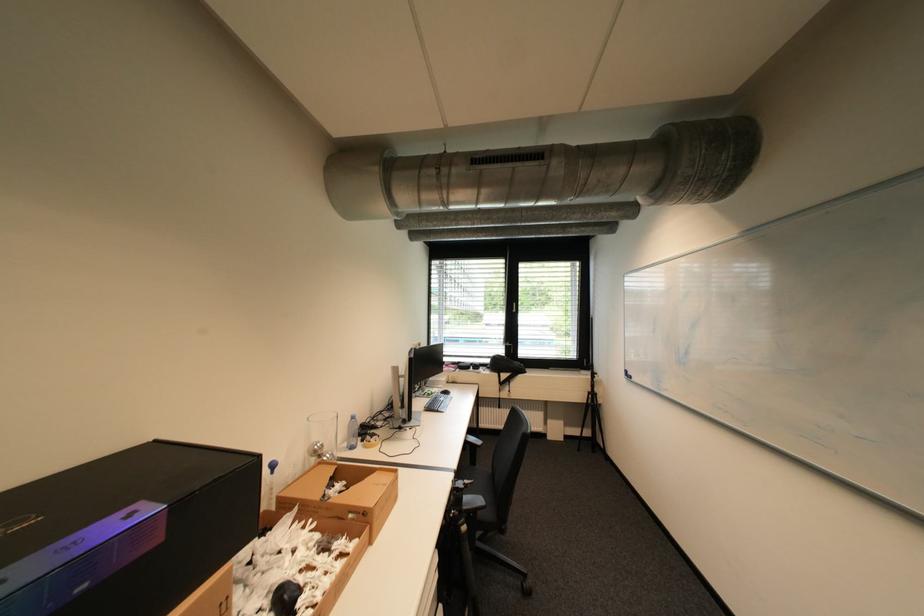
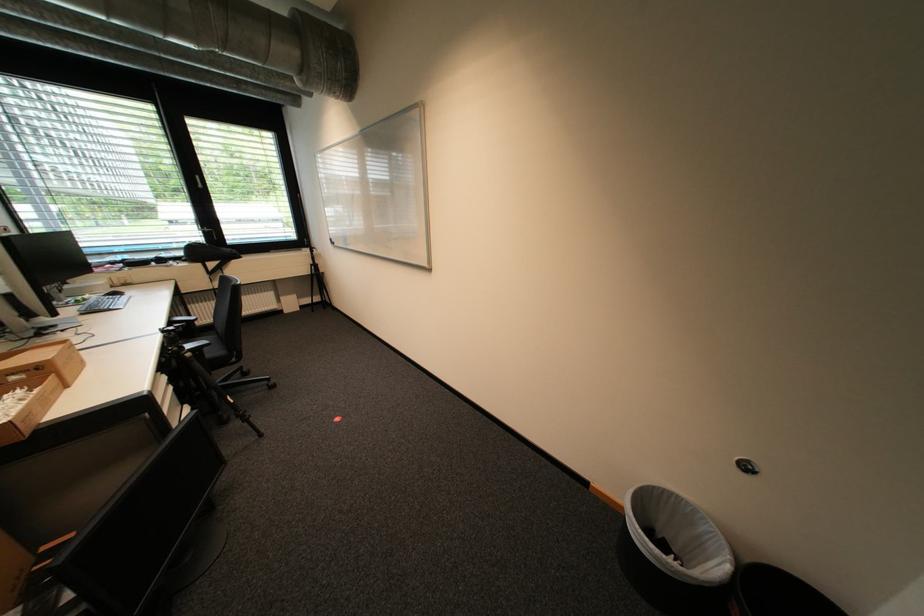
Find the pixel in the second image that matches point (359, 513) in the first image.

(20, 375)